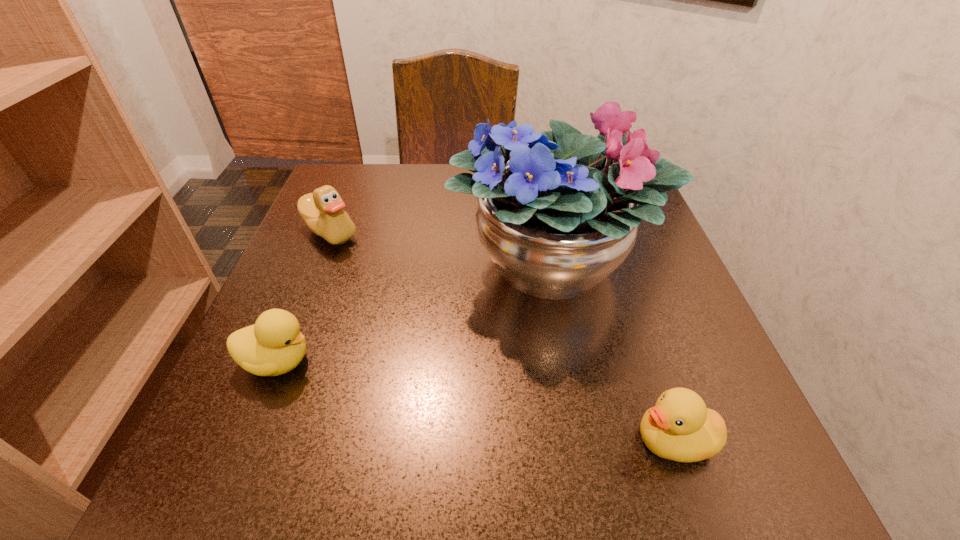
Image resolution: width=960 pixels, height=540 pixels. I want to click on free space that is in between the nearest duck and the second farthest duck, so click(475, 401).

Locate an element on the screen. This screenshot has height=540, width=960. free spot between the nearest duck and the bouquet is located at coordinates (612, 352).

In order to click on vacant area that lies between the tallest object and the farthest duck in this screenshot , I will do `click(442, 248)`.

Find the location of `unoccupied area between the rightmost duck and the farthest duck`. unoccupied area between the rightmost duck and the farthest duck is located at coordinates (502, 336).

Identify which object is the second nearest to the nearest object. Please provide its 2D coordinates. Your answer should be formatted as a tuple, i.e. [(x, y)], where the tuple contains the x and y coordinates of a point satisfying the conditions above.

[(274, 345)]

Point out which object is positioned as the third nearest to the farthest duck. Please provide its 2D coordinates. Your answer should be formatted as a tuple, i.e. [(x, y)], where the tuple contains the x and y coordinates of a point satisfying the conditions above.

[(679, 427)]

Identify the location of duck that can be found as the second closest to the second nearest object. (679, 427).

In order to click on duck that can be found as the second closest to the nearest object in this screenshot , I will do `click(322, 211)`.

I want to click on free location that satisfies the following two spatial constraints: 1. on the front side of the bouquet; 2. on the front-facing side of the second nearest object, so click(x=570, y=361).

Where is `vacant point that satisfies the following two spatial constraints: 1. at the beak of the tallest object; 2. on the right side of the farthest duck`? The width and height of the screenshot is (960, 540). vacant point that satisfies the following two spatial constraints: 1. at the beak of the tallest object; 2. on the right side of the farthest duck is located at coordinates (317, 264).